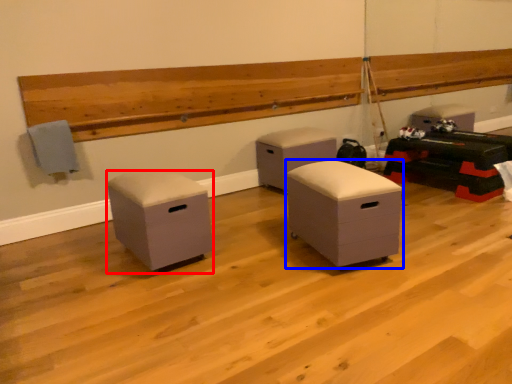
Question: Which object is closer to the camera taking this photo, furniture (highlighted by a red box) or furniture (highlighted by a blue box)?

Choices:
 (A) furniture
 (B) furniture

Answer: (B)